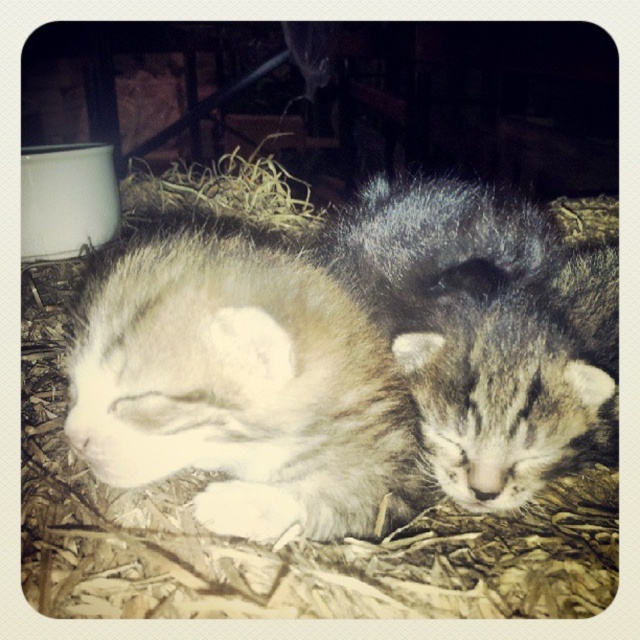
Question: Among these objects, which one is nearest to the camera?

Choices:
 (A) white fluffy cat at center
 (B) fuzzy brown cat at center

Answer: (A)

Question: Can you confirm if white fluffy cat at center is positioned below brown straw at upper center?

Choices:
 (A) yes
 (B) no

Answer: (A)

Question: Does white fluffy cat at center have a greater width compared to fuzzy brown cat at center?

Choices:
 (A) yes
 (B) no

Answer: (B)

Question: Among these points, which one is farthest from the camera?

Choices:
 (A) (113, 312)
 (B) (316, 209)

Answer: (B)

Question: Does white fluffy cat at center appear over brown straw at upper center?

Choices:
 (A) no
 (B) yes

Answer: (A)

Question: Which object appears farthest from the camera in this image?

Choices:
 (A) fuzzy brown cat at center
 (B) brown straw at upper center
 (C) white fluffy cat at center

Answer: (B)